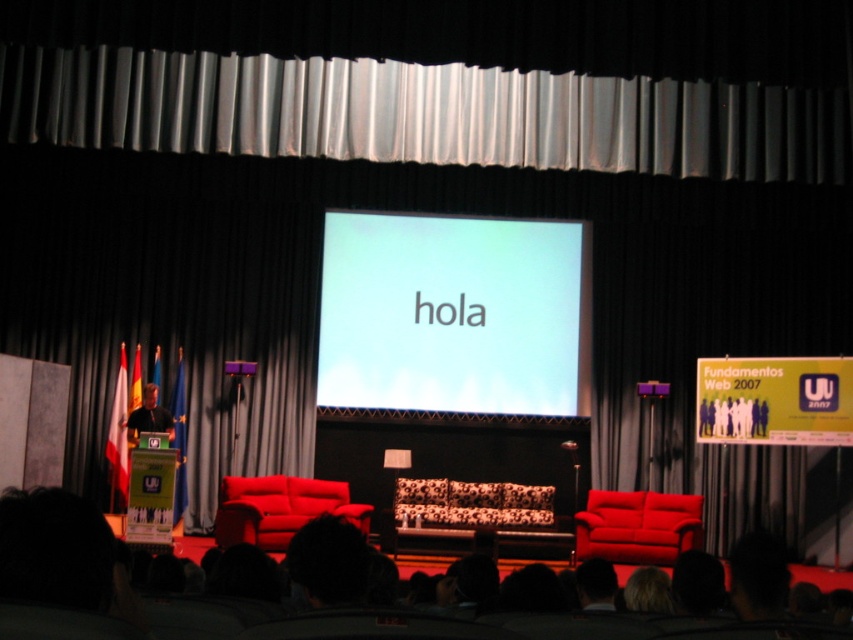
You are a photographer standing behind the camera. You want to capture a closeup shot of the dark hair at center without moving the camera. Can you adjust the zoom to focus on it clearly?

The dark hair at center is 4.15 feet away from the camera. Since this distance is relatively close, adjusting the zoom to focus on it should be possible, provided the camera has a sufficient zoom capability for that range.

You are an event organizer who needs to adjust the seating arrangement for a VIP guest. The guest prefers to sit facing the white glossy projection screen at center and away from the dark hair at center. Based on the stage setup, where should the VIP guest be seated?

The white glossy projection screen at center is positioned on the right side of dark hair at center. Therefore, the VIP guest should be seated to the right side of the dark hair at center to face the projection screen and be away from the dark hair at center.

You are an event planner standing at the back of the room. You need to ensure that the white glossy projection screen at center is positioned exactly at the center of the stage. Based on the coordinates provided, is the screen correctly centered?

The white glossy projection screen at center is positioned at coordinates point (x=451, y=314), which is very close to the center point of the stage. Since the coordinates are nearly exact, the screen is correctly centered.